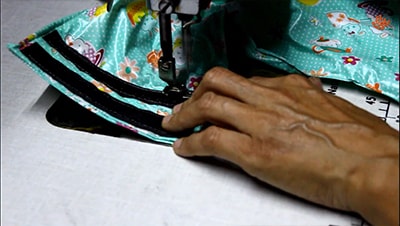
The image size is (400, 226). Identify the location of white table. (122, 184).